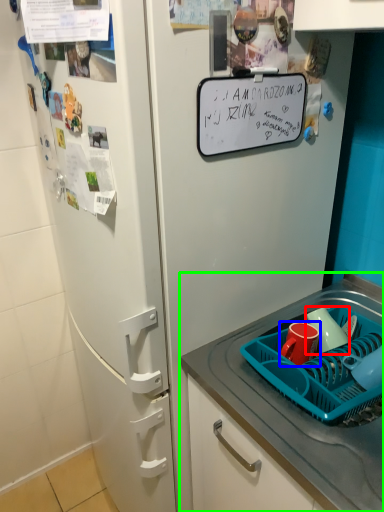
Question: Which object is the closest to the mug (highlighted by a red box)? Choose among these: coffee cup (highlighted by a blue box) or desk (highlighted by a green box).

Choices:
 (A) coffee cup
 (B) desk

Answer: (A)